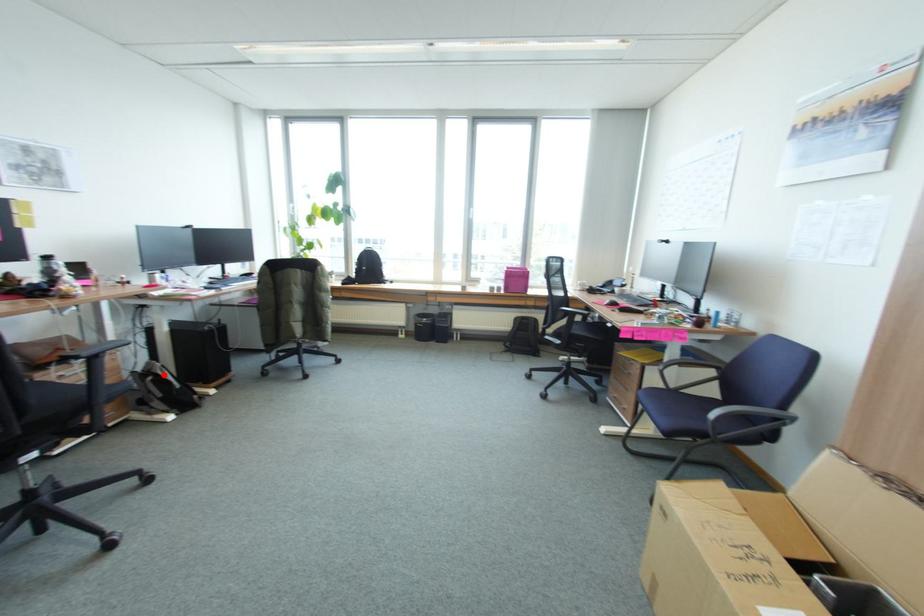
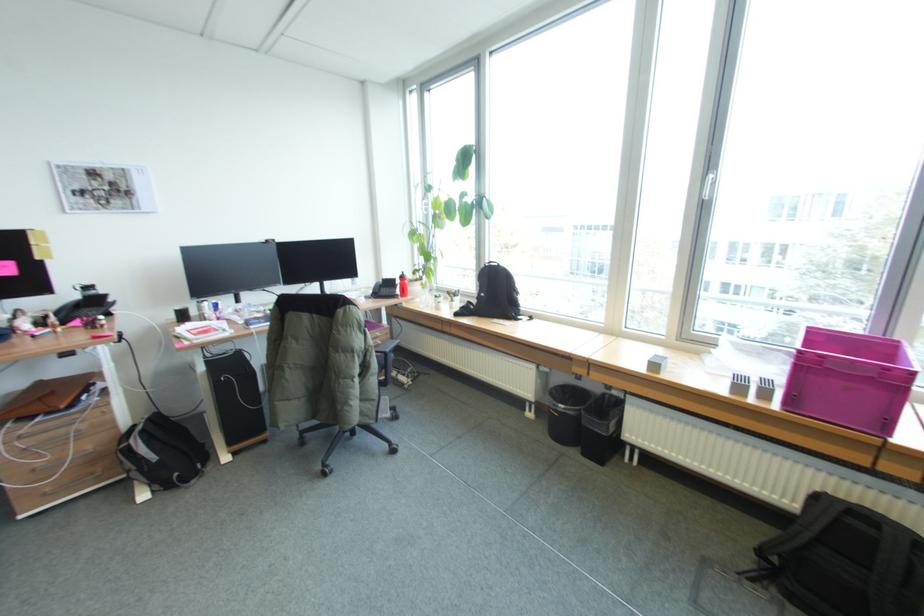
Question: I am providing you with two images of the same scene from different viewpoints. Given a red point in image1, look at the same physical point in image2. Is it:

Choices:
 (A) Closer to the viewpoint
 (B) Farther from the viewpoint

Answer: (A)